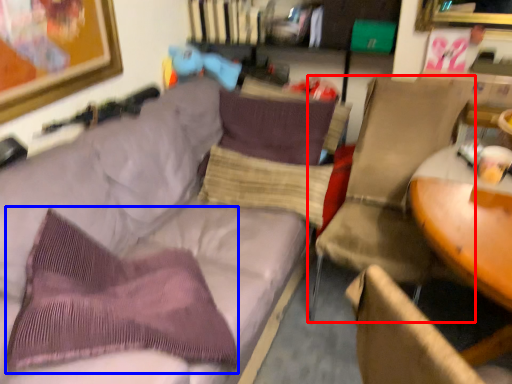
Question: Which of the following is the closest to the observer, chair (highlighted by a red box) or throw pillow (highlighted by a blue box)?

Choices:
 (A) chair
 (B) throw pillow

Answer: (B)